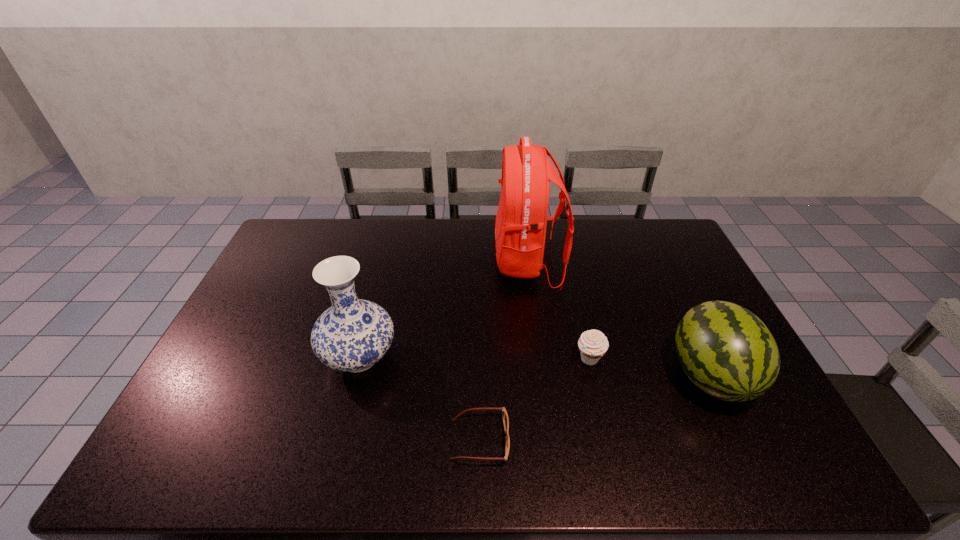
Locate an element on the screen. This screenshot has width=960, height=540. unoccupied area between the rightmost object and the shortest object is located at coordinates (595, 408).

Identify the location of free area in between the spectacles and the fourth tallest object. The width and height of the screenshot is (960, 540). (535, 400).

Identify the location of free area in between the leftmost object and the spectacles. This screenshot has height=540, width=960. (420, 399).

You are a GUI agent. You are given a task and a screenshot of the screen. Output one action in this format:
    pyautogui.click(x=<x>, y=<y>)
    Task: Click on the object that is the third closest one to the spectacles
    
    Given the screenshot: What is the action you would take?
    pyautogui.click(x=520, y=229)

Find the location of a particular element. The height and width of the screenshot is (540, 960). object that is the third closest to the third tallest object is located at coordinates pos(505,416).

You are a GUI agent. You are given a task and a screenshot of the screen. Output one action in this format:
    pyautogui.click(x=<x>, y=<y>)
    Task: Click on the free region that satisfies the following two spatial constraints: 1. on the front side of the muffin; 2. on the front-facing side of the spectacles
    The height and width of the screenshot is (540, 960).
    Given the screenshot: What is the action you would take?
    pyautogui.click(x=609, y=440)

Identify the location of vacant space that satisfies the following two spatial constraints: 1. on the back side of the muffin; 2. on the main compartment of the tallest object. (566, 262).

Locate an element on the screen. The width and height of the screenshot is (960, 540). free spot that satisfies the following two spatial constraints: 1. on the main compartment of the farthest object; 2. on the front side of the leftmost object is located at coordinates (540, 357).